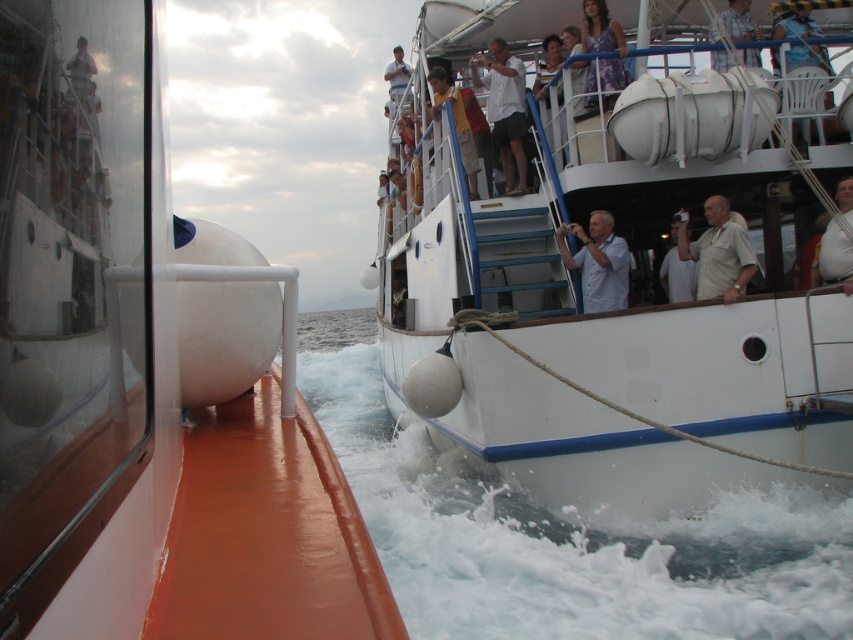
Which is more to the left, white matte boat at upper center or purple floral dress at upper center?

purple floral dress at upper center

Between white matte boat at upper center and purple floral dress at upper center, which one is positioned lower?

white matte boat at upper center

Who is more forward, (834,38) or (611,93)?

Point (611,93) is in front.

Find the location of `white matte boat at upper center`. white matte boat at upper center is located at coordinates (619, 317).

Between point (735, 540) and point (595, 10), which one is positioned behind?

The point (595, 10) is behind.

Who is shorter, white frothy water at lower center or purple floral dress at upper center?

purple floral dress at upper center

Who is more forward, (357, 458) or (625, 84)?

Point (625, 84)

Where is `white frothy water at lower center`? The height and width of the screenshot is (640, 853). white frothy water at lower center is located at coordinates (564, 532).

Based on the photo, is white fabric shirt at upper right to the left of white matte person at upper center from the viewer's perspective?

No, white fabric shirt at upper right is not to the left of white matte person at upper center.

Does white fabric shirt at upper right appear over white matte person at upper center?

No.

Find the location of `white fabric shirt at upper right`. white fabric shirt at upper right is located at coordinates (833, 257).

The width and height of the screenshot is (853, 640). Identify the location of white fabric shirt at upper right. point(833,257).